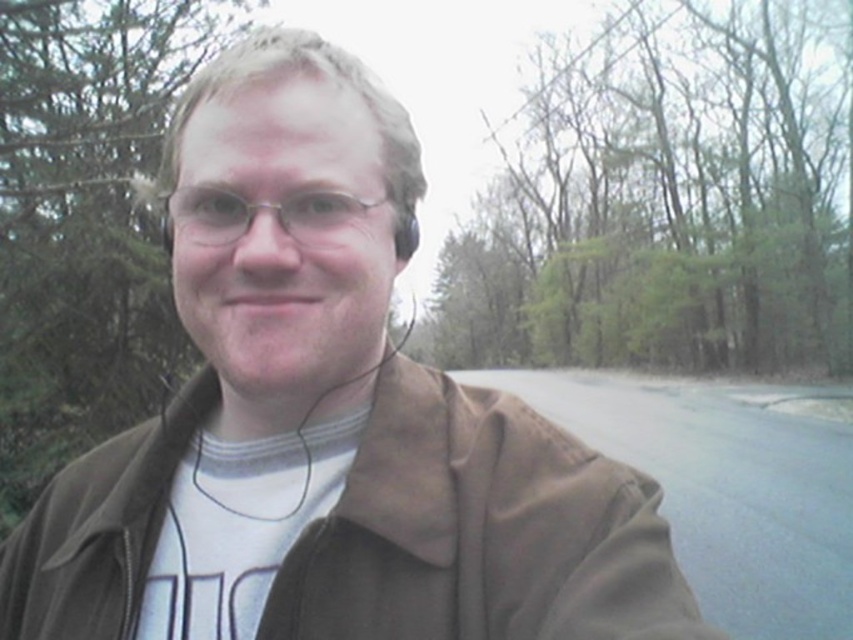
Question: Can you confirm if brown matte jacket at center is positioned to the right of metallic silver glasses at center?

Choices:
 (A) yes
 (B) no

Answer: (B)

Question: Which point is closer to the camera?

Choices:
 (A) metallic silver glasses at center
 (B) brown matte jacket at center

Answer: (B)

Question: Considering the relative positions of brown matte jacket at center and metallic silver glasses at center in the image provided, where is brown matte jacket at center located with respect to metallic silver glasses at center?

Choices:
 (A) below
 (B) above

Answer: (A)

Question: Does brown matte jacket at center have a smaller size compared to metallic silver glasses at center?

Choices:
 (A) no
 (B) yes

Answer: (A)